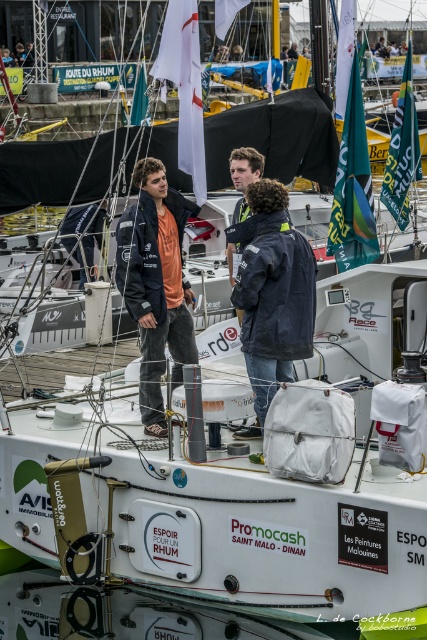
You are a photographer positioned on the dock and want to capture both the matte black jacket at center and the matte orange shirt at center in a single frame. Since the camera has a limited focus area, which object should you prioritize to ensure both are visible without moving the camera?

The matte black jacket at center occupies less space than the matte orange shirt at center, so prioritizing the larger matte orange shirt at center in the frame will help ensure both are visible without moving the camera.

You are a photographer trying to capture a candid shot of the two people at the center of the boat. You want to ensure both the matte black jacket at center and the matte orange shirt at center are visible in the frame. Based on their positions, which one should you focus on first to include both in the shot?

The matte black jacket at center is positioned on the left side of the matte orange shirt at center. To include both in the shot, focus on the matte orange shirt at center first as it is on the right, allowing you to frame from left to right to capture both.